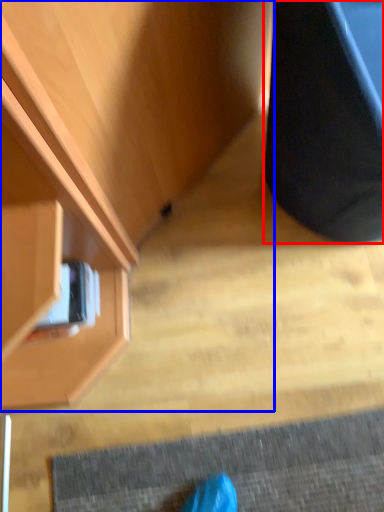
Question: Which object is closer to the camera taking this photo, furniture (highlighted by a red box) or cabinetry (highlighted by a blue box)?

Choices:
 (A) furniture
 (B) cabinetry

Answer: (A)